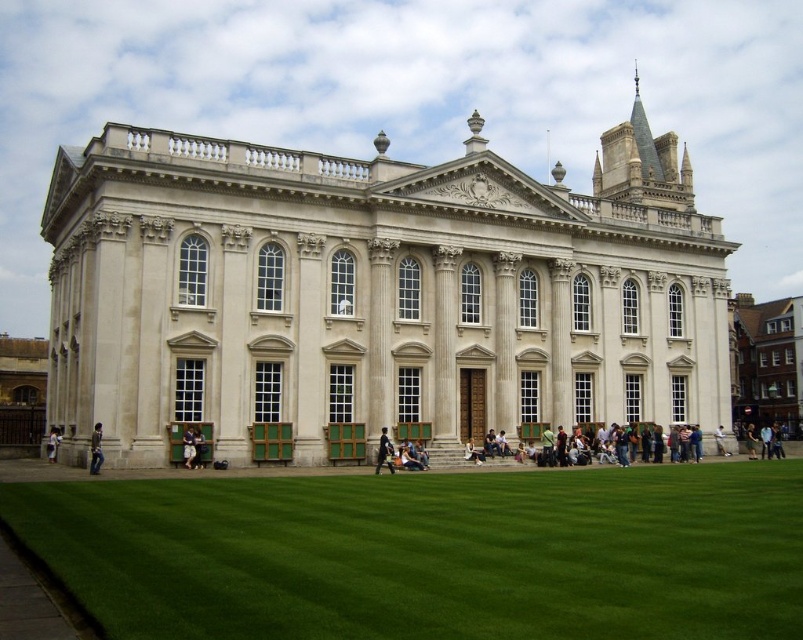
Question: Can you confirm if light brown leather jacket at lower center is positioned below light brown wooden chair at lower center?

Choices:
 (A) yes
 (B) no

Answer: (B)

Question: Among these objects, which one is farthest from the camera?

Choices:
 (A) light brown leather jacket at lower center
 (B) beige stone building at right

Answer: (B)

Question: Where is green grass at lower center located in relation to light brown leather jacket at lower left in the image?

Choices:
 (A) below
 (B) above

Answer: (B)

Question: Can you confirm if beige stone building at right is positioned to the left of brown leather jacket at lower left?

Choices:
 (A) yes
 (B) no

Answer: (B)

Question: Which object appears farthest from the camera in this image?

Choices:
 (A) light brown wooden chair at lower center
 (B) light brown leather jacket at lower left

Answer: (B)

Question: Estimate the real-world distances between objects in this image. Which object is closer to the dark blue fabric jacket at center?

Choices:
 (A) green grass at lower center
 (B) beige stone building at right
 (C) brown leather jacket at lower left
 (D) light brown wooden chair at lower center

Answer: (D)